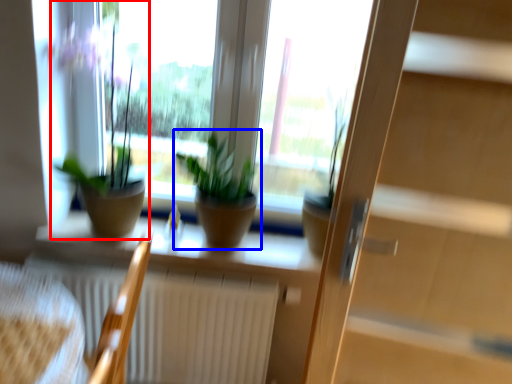
Question: Which of the following is the farthest to the observer, houseplant (highlighted by a red box) or houseplant (highlighted by a blue box)?

Choices:
 (A) houseplant
 (B) houseplant

Answer: (B)